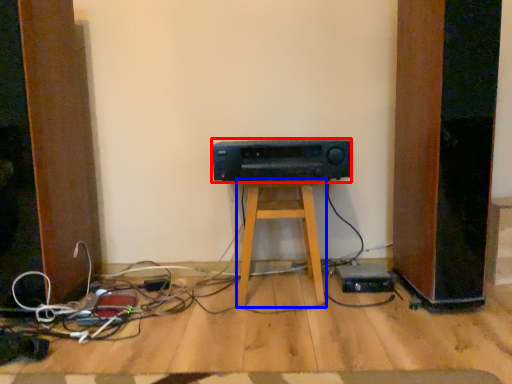
Question: Which object appears farthest to the camera in this image, amplifier (highlighted by a red box) or furniture (highlighted by a blue box)?

Choices:
 (A) amplifier
 (B) furniture

Answer: (B)